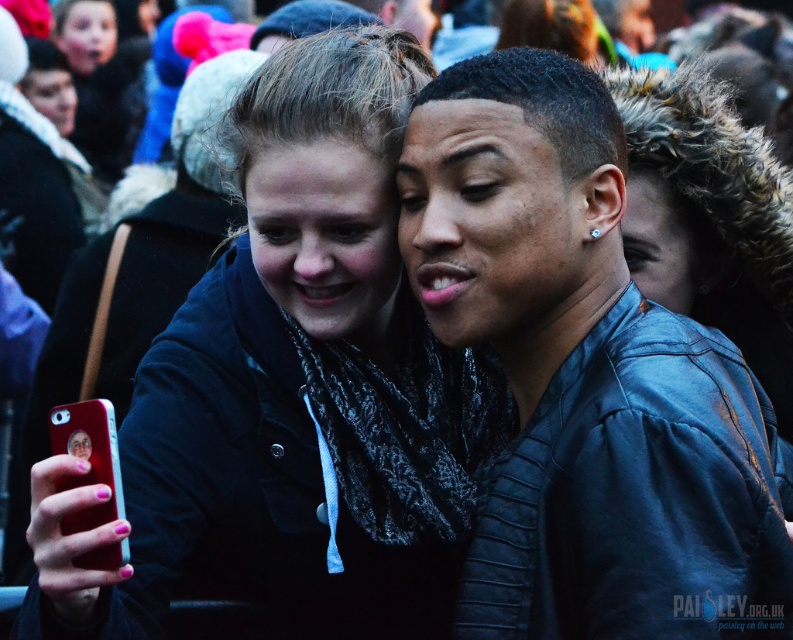
You are a photographer at the event and need to capture a closeup shot of the metallic red phone at lower left without including the leather jacket at center in the frame. Given their sizes, is this feasible?

The leather jacket at center is wider than the metallic red phone at lower left, so it may be challenging to frame the metallic red phone at lower left without including the leather jacket at center due to its larger size.

You are a photographer trying to capture the best shot of the young woman and the young man taking a selfie. You notice a point at coordinates (585, 376). Based on the scene description, where is this point located?

The point at coordinates (585, 376) is located on the leather jacket at center.

You are at a crowded event and need to identify which jacket is on the right side between the leather jacket at center and the matte black jacket at center. Which one is on the right?

The leather jacket at center is positioned on the right side of the matte black jacket at center, so the leather jacket at center is on the right.